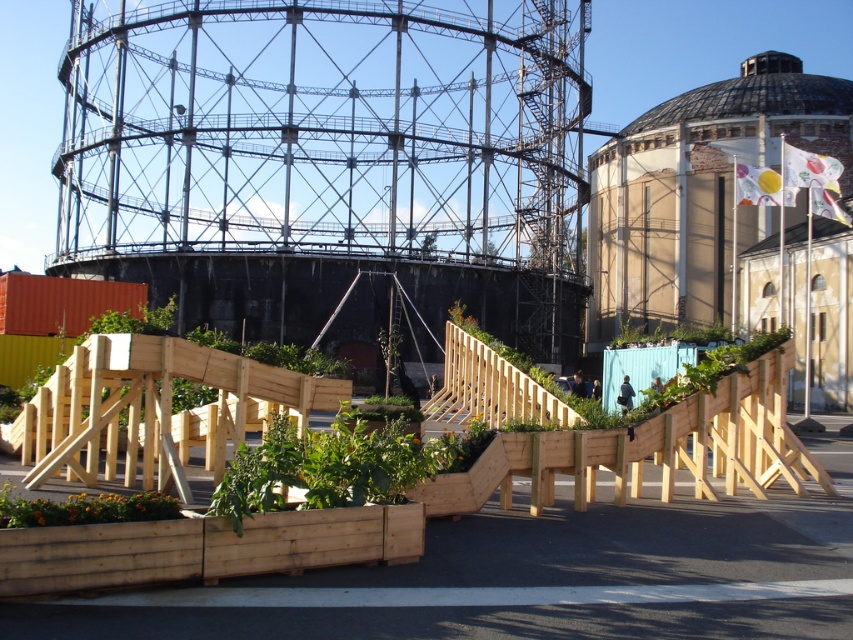
Is point (386, 483) farther from camera compared to point (64, 513)?

Yes, it is behind point (64, 513).

Which is above, green wooden planter at center or wooden planter at lower left?

green wooden planter at center is higher up.

What do you see at coordinates (331, 467) in the screenshot? I see `green wooden planter at center` at bounding box center [331, 467].

Where is `green wooden planter at center`? green wooden planter at center is located at coordinates (331, 467).